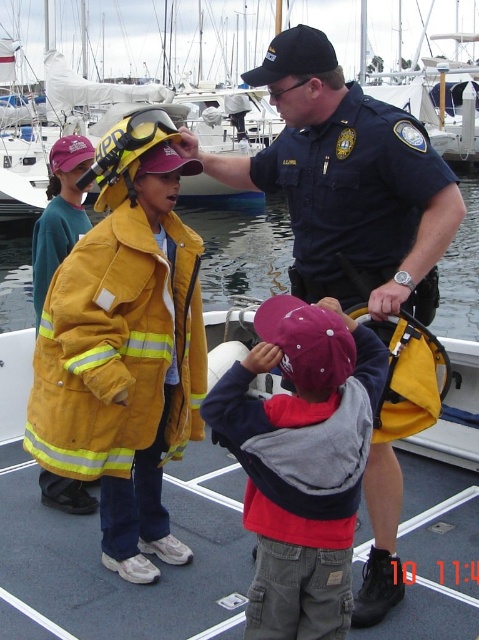
Question: Which point is farther to the camera?

Choices:
 (A) yellow fire jacket at center
 (B) dark blue uniform at center
 (C) yellow fireproof jacket at left

Answer: (A)

Question: Which point is closer to the camera taking this photo?

Choices:
 (A) (269, 301)
 (B) (44, 218)
 (C) (456, 211)

Answer: (A)

Question: Based on their relative distances, which object is nearer to the yellow fire jacket at center?

Choices:
 (A) maroon fabric cap at center
 (B) yellow fire-resistant jacket at left
 (C) dark blue uniform at center

Answer: (A)

Question: Is yellow fireproof jacket at left in front of yellow fire-resistant jacket at left?

Choices:
 (A) yes
 (B) no

Answer: (A)

Question: Does maroon fabric cap at center appear on the left side of yellow fire-resistant jacket at left?

Choices:
 (A) no
 (B) yes

Answer: (A)

Question: Does yellow fire jacket at center appear under yellow fire-resistant jacket at left?

Choices:
 (A) no
 (B) yes

Answer: (A)